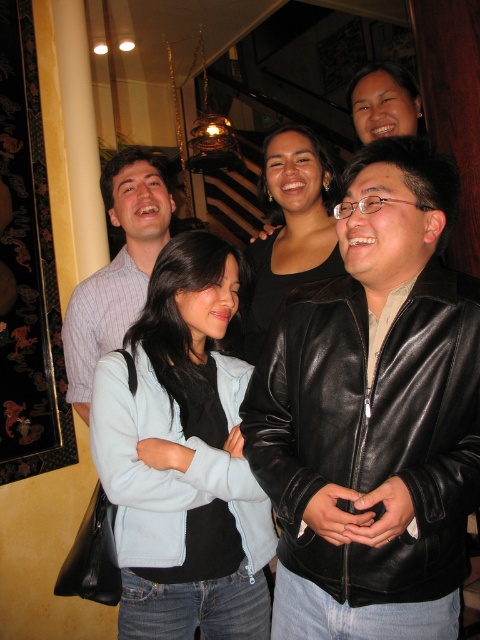
You are a photographer at the event and need to ensure that all clothing items are visible in the photo. The striped cotton shirt at left and the black leather jacket at center are partially obscured. Which clothing item requires more adjustment to fully show in the photo?

The black leather jacket at center requires more adjustment since it is larger than the striped cotton shirt at left, making it more likely to be obscured and needing more space to fully show.

You are standing in the same room as the group. You notice two points marked in the image. Point A is at coordinates point (464, 385) and Point B is at point (144, 259). Which point is closer to you?

Point A at point (464, 385) is closer to the viewer than point B at point (144, 259).